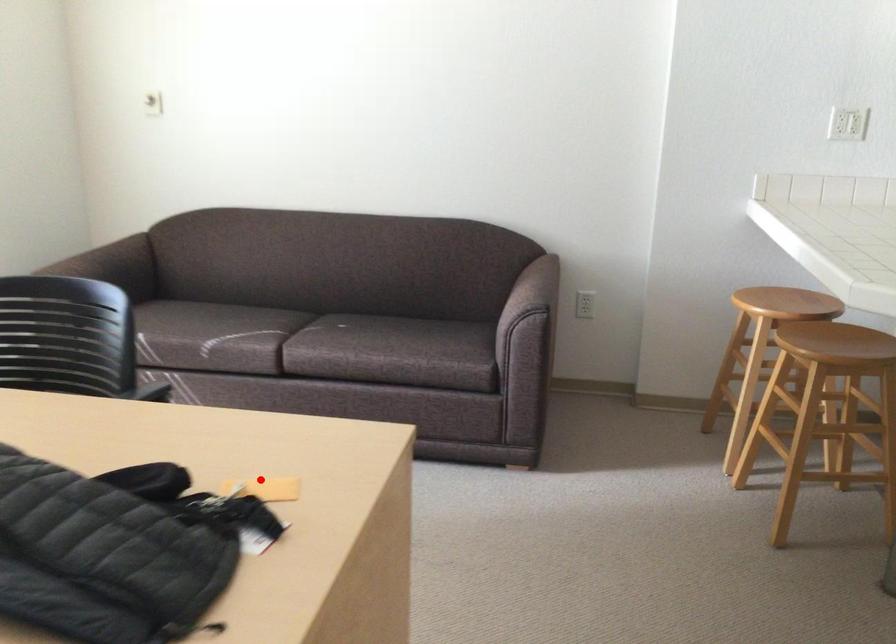
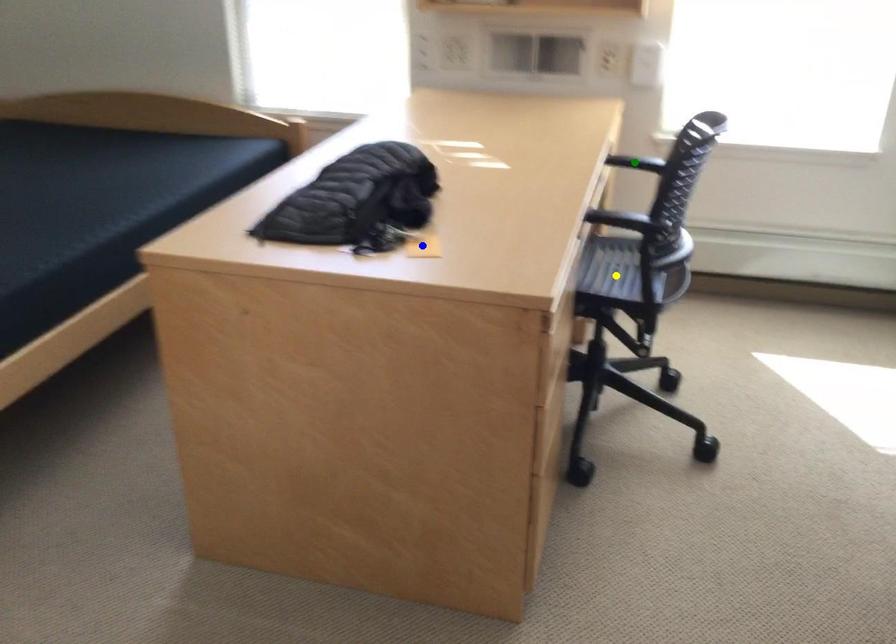
Question: I am providing you with two images of the same scene from different viewpoints. A red point is marked on the first image. You are given multiple points on the second image. Which spot in image 2 lines up with the point in image 1?

Choices:
 (A) blue point
 (B) green point
 (C) yellow point

Answer: (A)